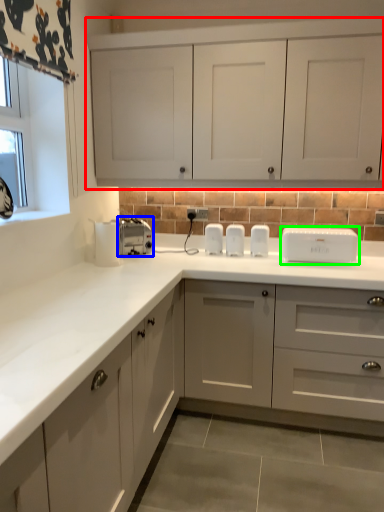
Question: Based on their relative distances, which object is nearer to cabinetry (highlighted by a red box)? Choose from toaster (highlighted by a blue box) and home appliance (highlighted by a green box).

Choices:
 (A) toaster
 (B) home appliance

Answer: (B)